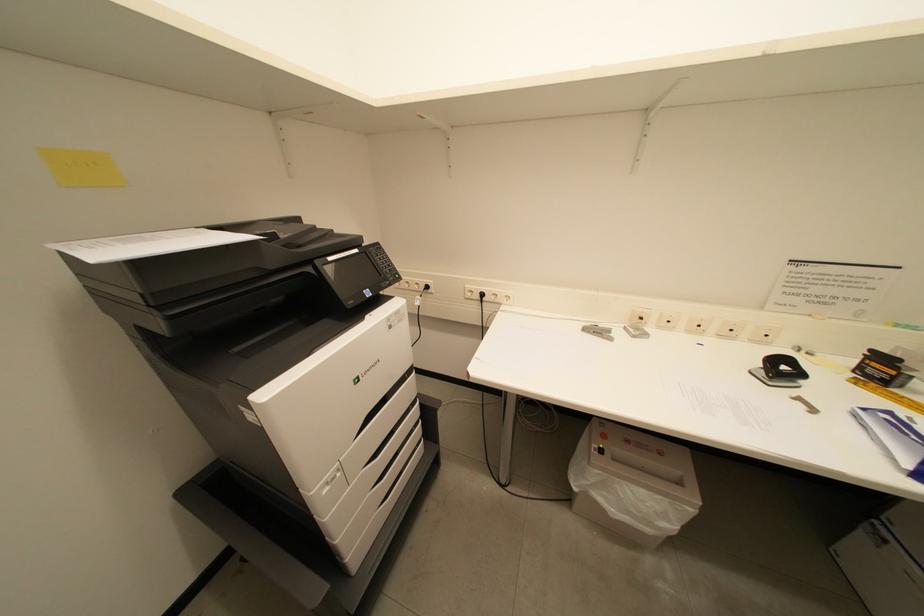
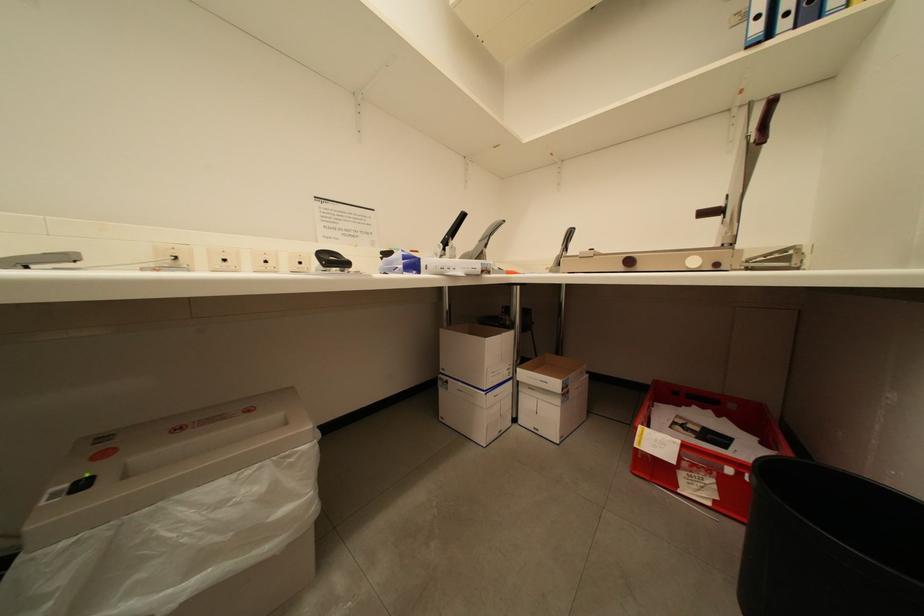
Question: How did the camera likely rotate?

Choices:
 (A) Left
 (B) Right
 (C) Up
 (D) Down

Answer: (B)